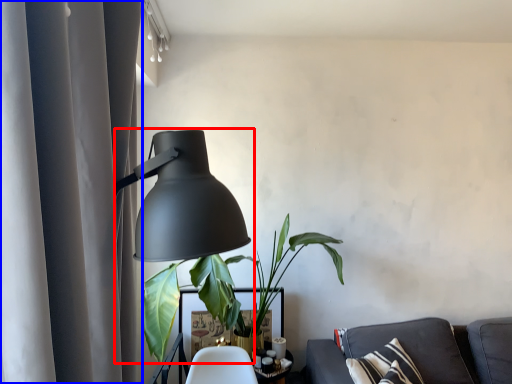
Question: Which point is closer to the camera, lamp (highlighted by a red box) or curtain (highlighted by a blue box)?

Choices:
 (A) lamp
 (B) curtain

Answer: (B)